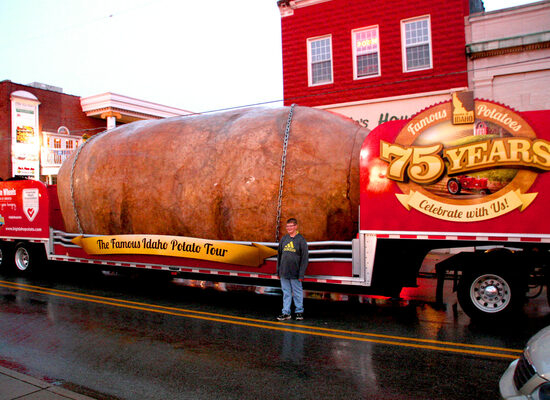
Identify the location of hood. (537, 346).